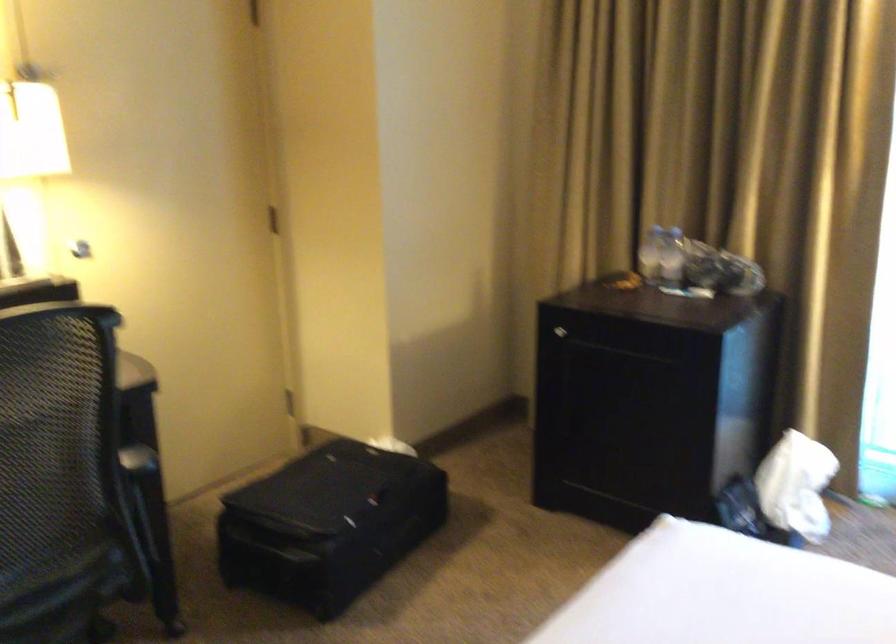
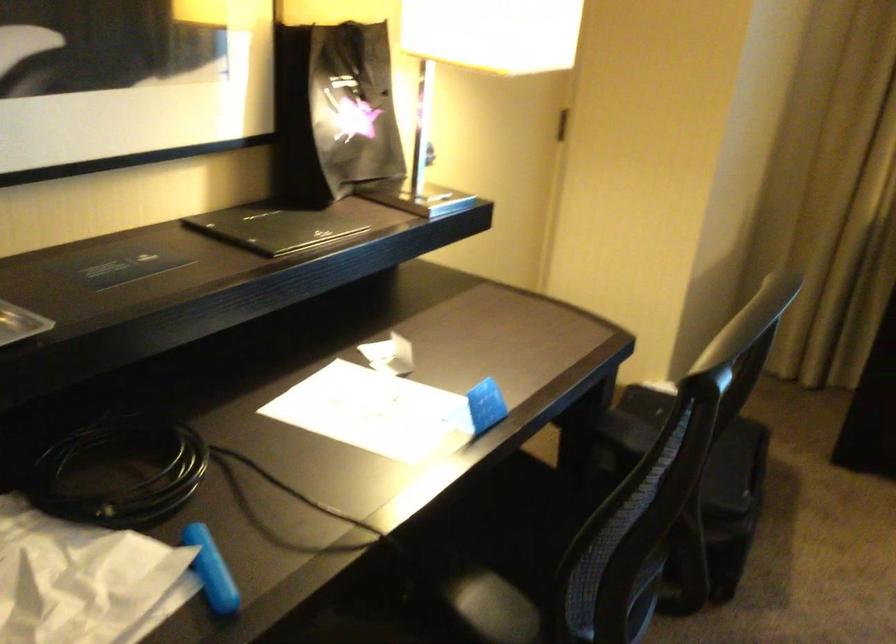
Question: I am providing you with two images of the same scene from different viewpoints. Which of the following objects are not visible in image2?

Choices:
 (A) chair sitting surface
 (B) black chair armrest
 (C) metal paper clip
 (D) black folder

Answer: (B)